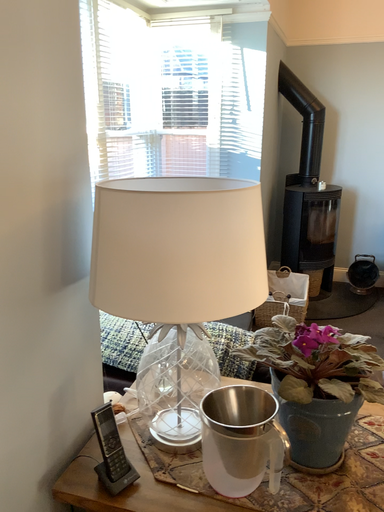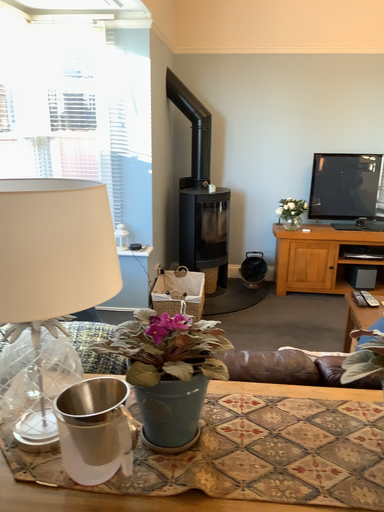
Question: How did the camera likely rotate when shooting the video?

Choices:
 (A) rotated right
 (B) rotated left

Answer: (A)